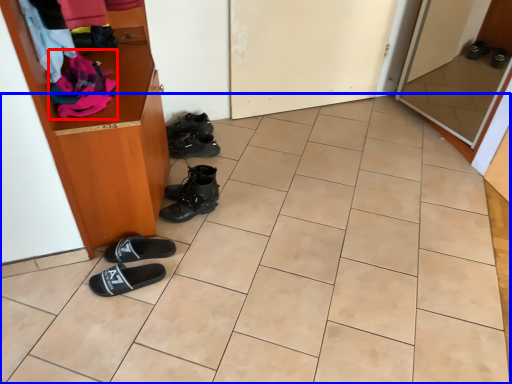
Question: Which object appears closest to the camera in this image, clothing (highlighted by a red box) or tile (highlighted by a blue box)?

Choices:
 (A) clothing
 (B) tile

Answer: (B)